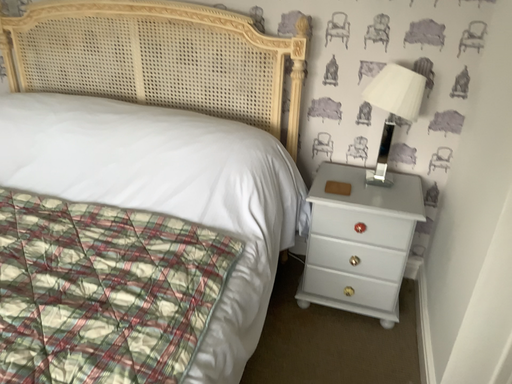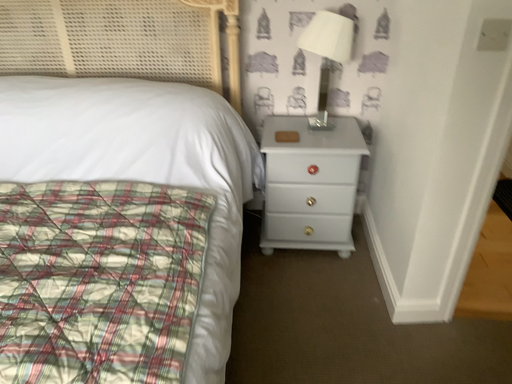
Question: Which way did the camera rotate in the video?

Choices:
 (A) rotated right
 (B) rotated left

Answer: (A)